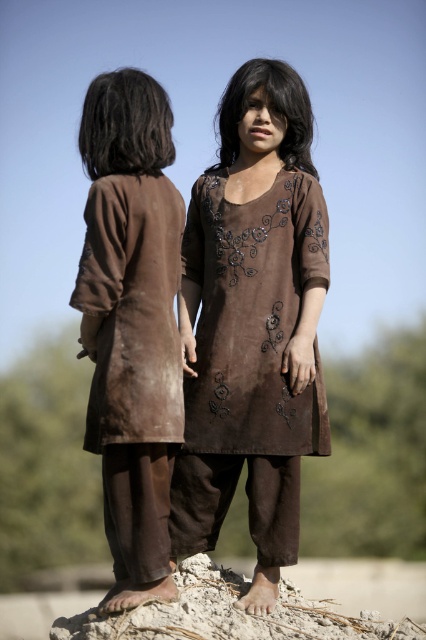
You are a photographer setting up a shoot with two children wearing brown suede dresses. The child in the brown suede dress at left is standing lower than the child in the brown suede dress at center. To ensure both are visible in the photo, where should you position your camera?

To ensure both children are visible, position the camera at a higher angle so you can see the brown suede dress at left, which is below the brown suede dress at center.

You are a fashion designer observing the two children in the image. You notice a point at coordinates (253, 324). Which child is wearing the brown suede kurta at center located nearest to this point?

The brown suede kurta at center is represented by point (253, 324), so the child wearing it is the one closest to this coordinate.